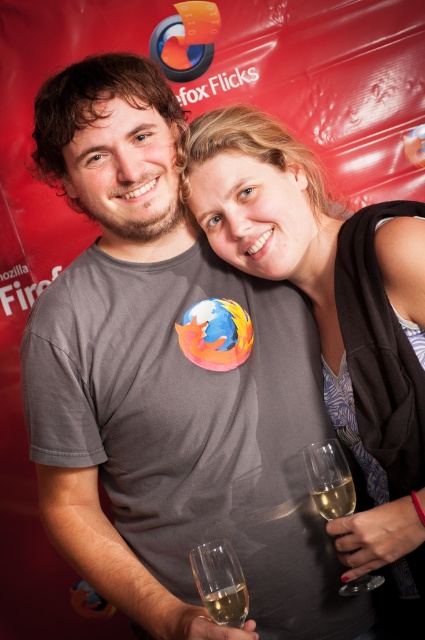
Question: Which point is closer to the camera?

Choices:
 (A) translucent glass at lower right
 (B) clear glass wine glass at lower right
 (C) clear glass wine glass at lower center
 (D) translucent glass at lower center

Answer: (D)

Question: Is clear glass wine glass at lower right above translucent glass at lower right?

Choices:
 (A) yes
 (B) no

Answer: (B)

Question: Is matte gray shirt at center to the right of clear glass wine glass at lower right from the viewer's perspective?

Choices:
 (A) no
 (B) yes

Answer: (B)

Question: Which object is positioned closest to the matte gray shirt at center?

Choices:
 (A) clear glass wine glass at lower center
 (B) clear glass wine glass at lower right
 (C) translucent glass at lower center
 (D) translucent glass at lower right

Answer: (B)

Question: Which point is farther to the camera?

Choices:
 (A) (317, 492)
 (B) (314, 444)

Answer: (B)

Question: Does clear glass wine glass at lower right have a lesser width compared to clear glass wine glass at lower center?

Choices:
 (A) yes
 (B) no

Answer: (B)